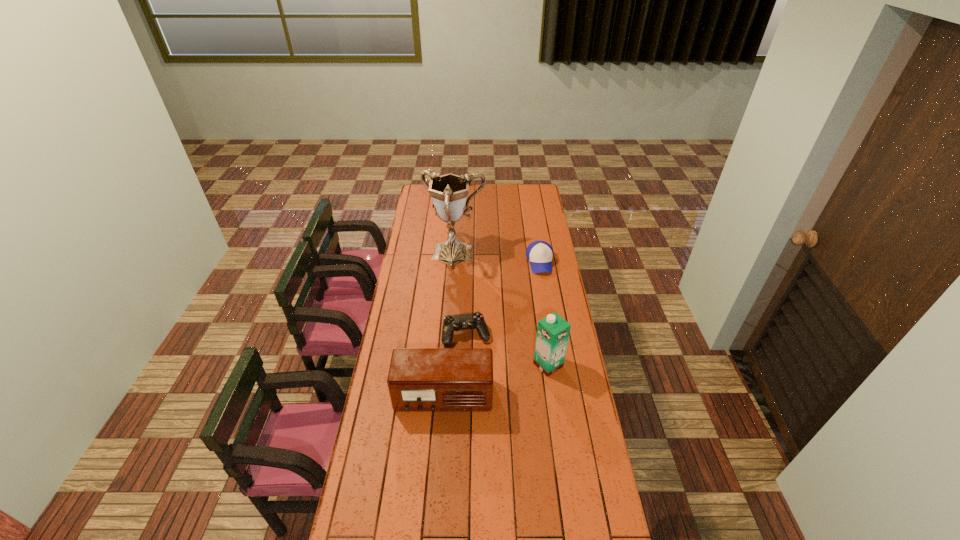
Find the location of a particular element. free space that is in between the baseball cap and the trophy cup is located at coordinates (497, 259).

I want to click on unoccupied position between the trophy cup and the carton, so click(x=501, y=310).

The width and height of the screenshot is (960, 540). I want to click on free point between the baseball cap and the third shortest object, so click(492, 330).

I want to click on vacant region between the nearest object and the baseball cap, so click(492, 330).

Where is `empty location between the baseball cap and the second tallest object`? This screenshot has width=960, height=540. empty location between the baseball cap and the second tallest object is located at coordinates (544, 314).

Identify the location of the third closest object relative to the fourth shortest object. (539, 253).

Point out which object is positioned as the fourth nearest to the second tallest object. Please provide its 2D coordinates. Your answer should be formatted as a tuple, i.e. [(x, y)], where the tuple contains the x and y coordinates of a point satisfying the conditions above.

[(448, 192)]

Where is `free space that satisfies the following two spatial constraints: 1. on the front side of the third nearest object; 2. on the right side of the tallest object`? free space that satisfies the following two spatial constraints: 1. on the front side of the third nearest object; 2. on the right side of the tallest object is located at coordinates (449, 335).